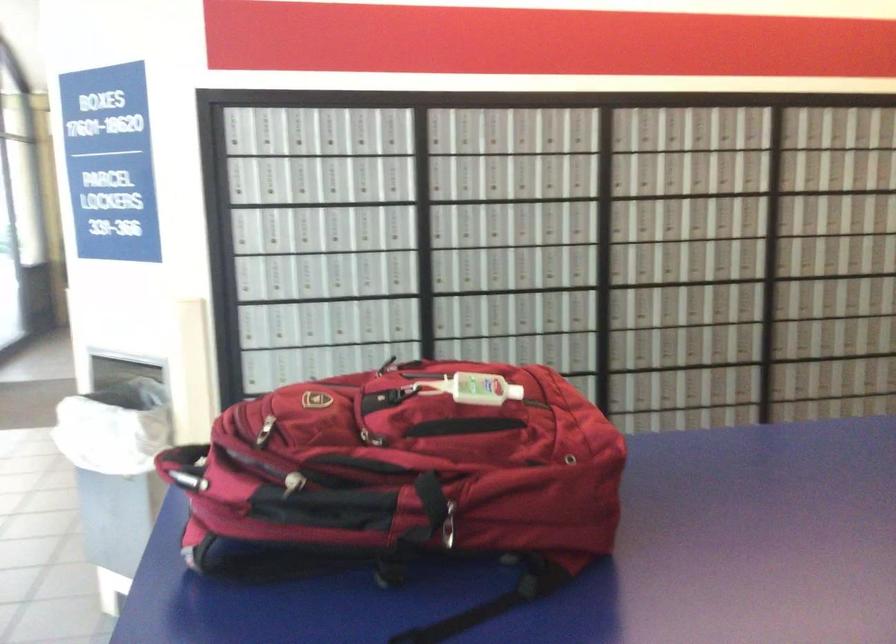
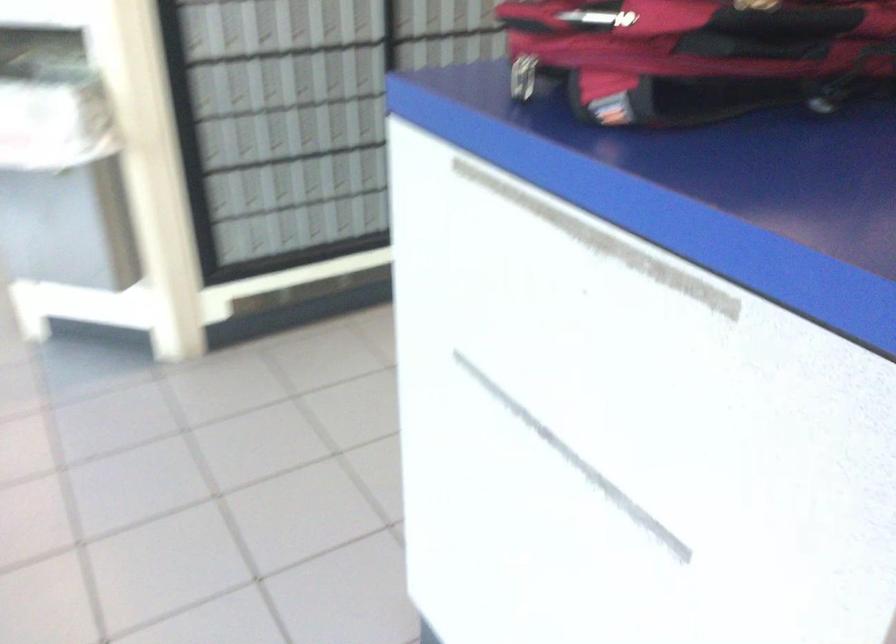
The images are taken continuously from a first-person perspective. In which direction is your viewpoint rotating?

The camera's rotation is toward right-down.